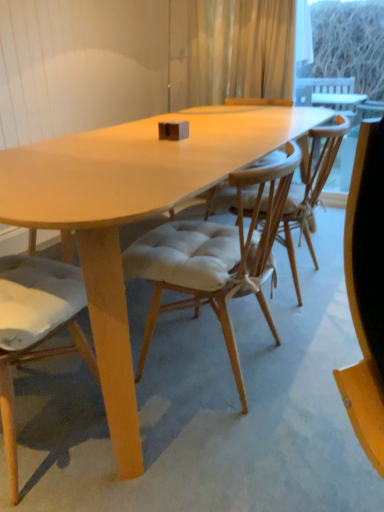
Locate an element on the screen. Image resolution: width=384 pixels, height=512 pixels. vacant point to the right of light beige fabric chair at center, the 1th chair when ordered from right to left is located at coordinates (304, 353).